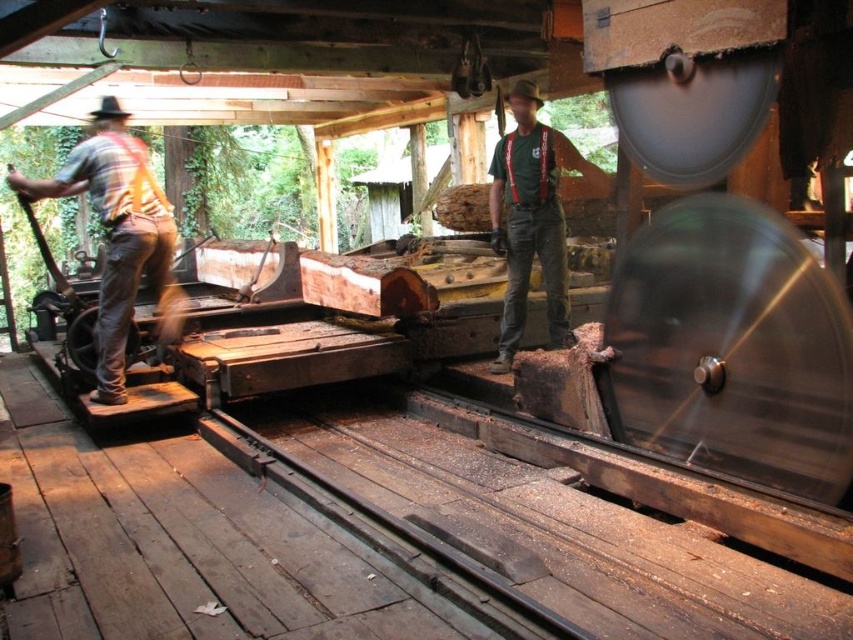
You are standing at the center of the sawmill and want to locate the rustic wood shirt at left. Which direction should you face to see it?

You should face to the left to see the rustic wood shirt at left since it is located at point (119, 236), which is to the left side of the scene.

You are a worker in the sawmill and need to reach the tool box located on the ground behind the rustic wood shirt at left and the green fabric shirt at center. Which shirt should you move first to access the tool box?

The rustic wood shirt at left is positioned under the green fabric shirt at center, so you should move the green fabric shirt at center first to access the tool box.